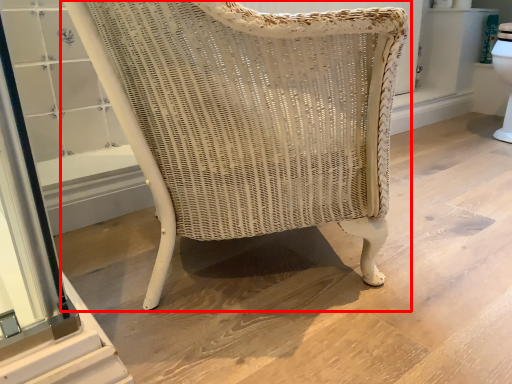
Question: From the image's perspective, what is the correct spatial relationship of chair (annotated by the red box) in relation to screen door?

Choices:
 (A) below
 (B) above

Answer: (B)